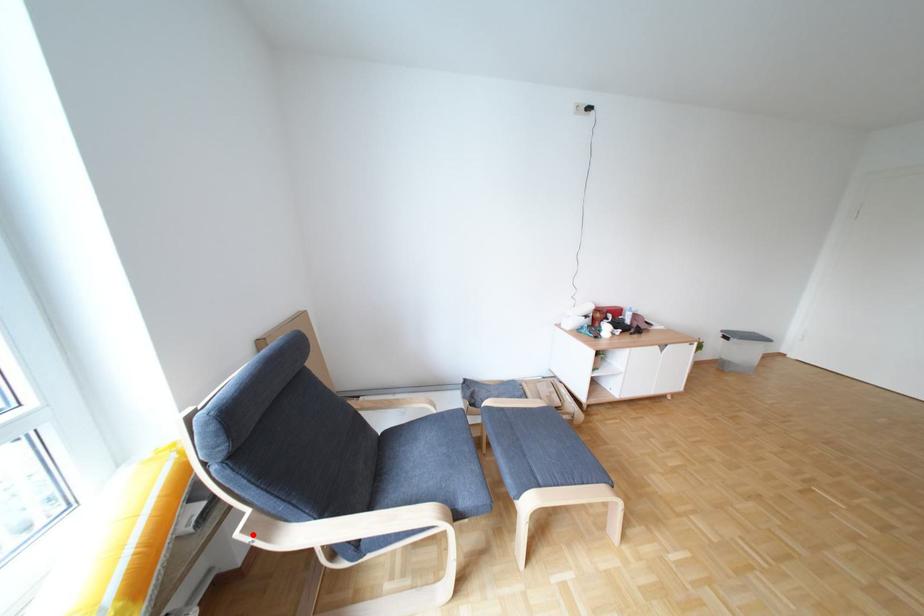
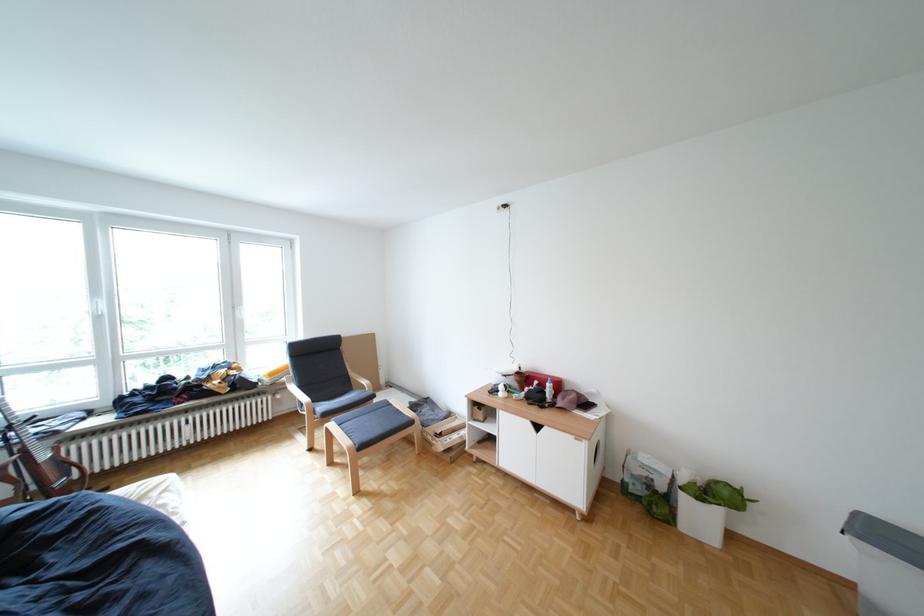
Question: I am providing you with two images of the same scene from different viewpoints. A red point is marked on the first image. Is the red point's position out of view in image 2?

Choices:
 (A) Yes
 (B) No

Answer: (A)